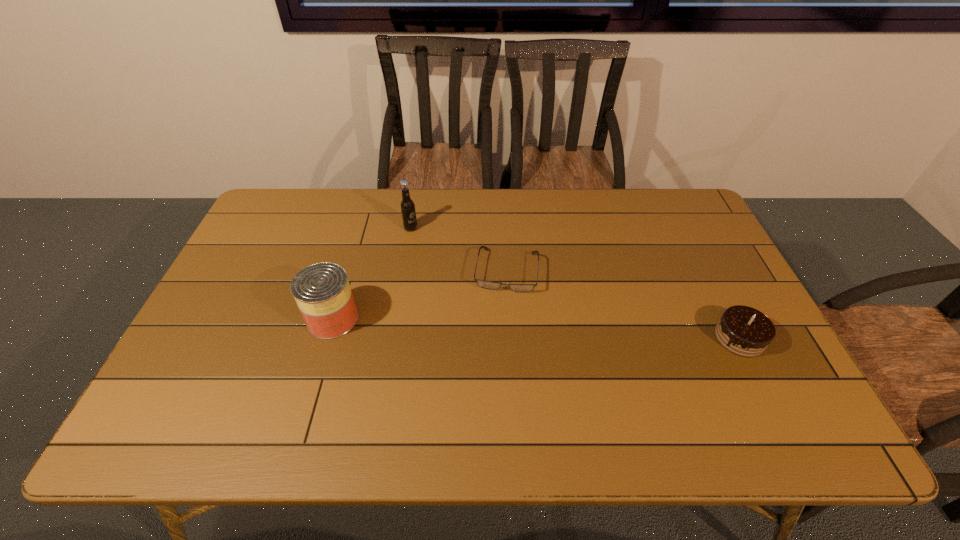
At what (x,y) coordinates should I click in order to perform the action: click on vacant spot on the desktop that is between the second tallest object and the rightmost object and is positioned on the front-facing side of the second farthest object. Please return your answer as a coordinate pair (x, y). Looking at the image, I should click on (499, 327).

Where is `vacant space on the desktop that is between the can and the chocolate cake and is positioned on the label of the farthest object`? The image size is (960, 540). vacant space on the desktop that is between the can and the chocolate cake and is positioned on the label of the farthest object is located at coordinates (589, 331).